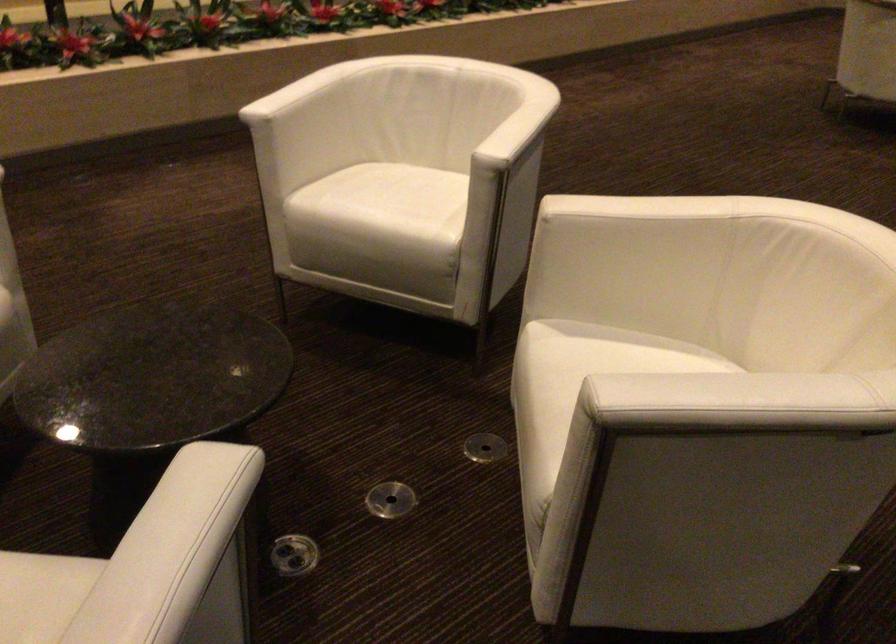
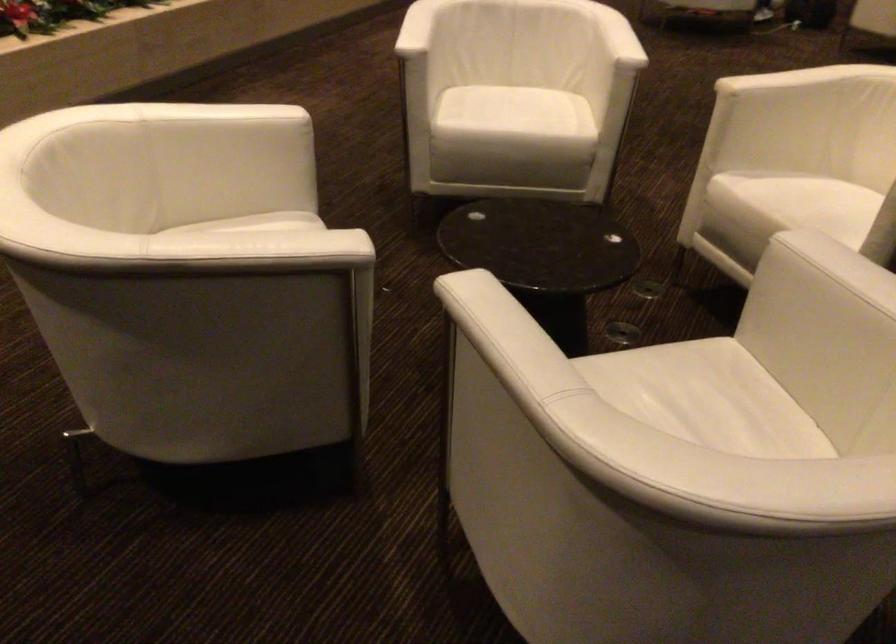
Question: Which direction would the cameraman need to move to produce the second image? Reply with the corresponding letter.

Choices:
 (A) Left
 (B) Right
 (C) Forward
 (D) Backward

Answer: (A)